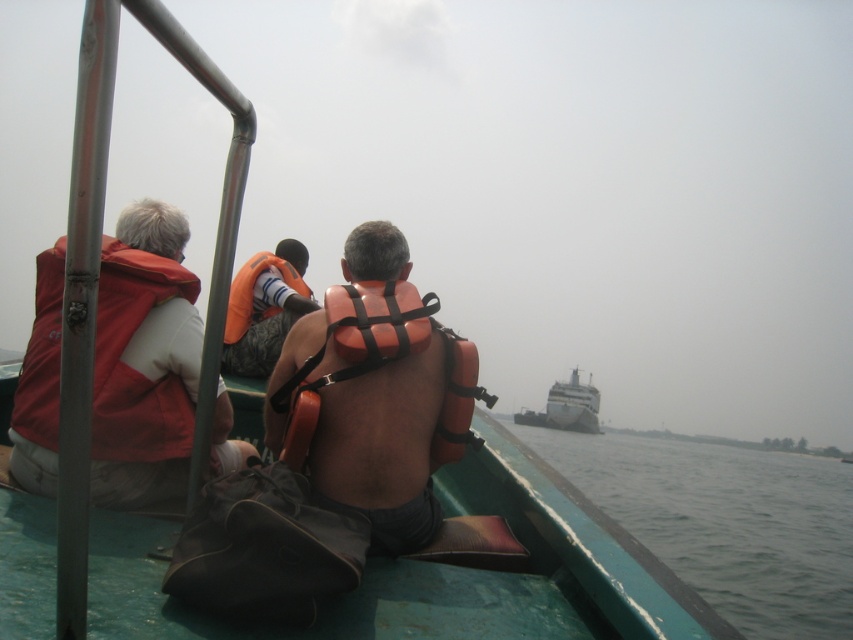
Can you confirm if matte orange life vest at center is wider than green smooth water at lower right?

Incorrect, matte orange life vest at center's width does not surpass green smooth water at lower right's.

Can you confirm if matte orange life vest at center is positioned to the right of green smooth water at lower right?

In fact, matte orange life vest at center is to the left of green smooth water at lower right.

Does point (134, 307) come in front of point (602, 464)?

That is True.

Locate an element on the screen. matte orange life vest at center is located at coordinates (144, 360).

Between green smooth water at lower right and white glossy cruise ship at center, which one has more height?

Standing taller between the two is green smooth water at lower right.

Can you confirm if green smooth water at lower right is taller than white glossy cruise ship at center?

Indeed, green smooth water at lower right has a greater height compared to white glossy cruise ship at center.

At what (x,y) coordinates should I click in order to perform the action: click on green smooth water at lower right. Please return your answer as a coordinate pair (x, y). The image size is (853, 640). Looking at the image, I should click on (726, 522).

Does matte orange life vest at center have a lesser width compared to orange life vest at center?

No.

The height and width of the screenshot is (640, 853). What do you see at coordinates (144, 360) in the screenshot? I see `matte orange life vest at center` at bounding box center [144, 360].

Between point (405, 532) and point (323, 429), which one is positioned in front?

Point (323, 429) is in front.

Find the location of `matte orange life vest at center`. matte orange life vest at center is located at coordinates (144, 360).